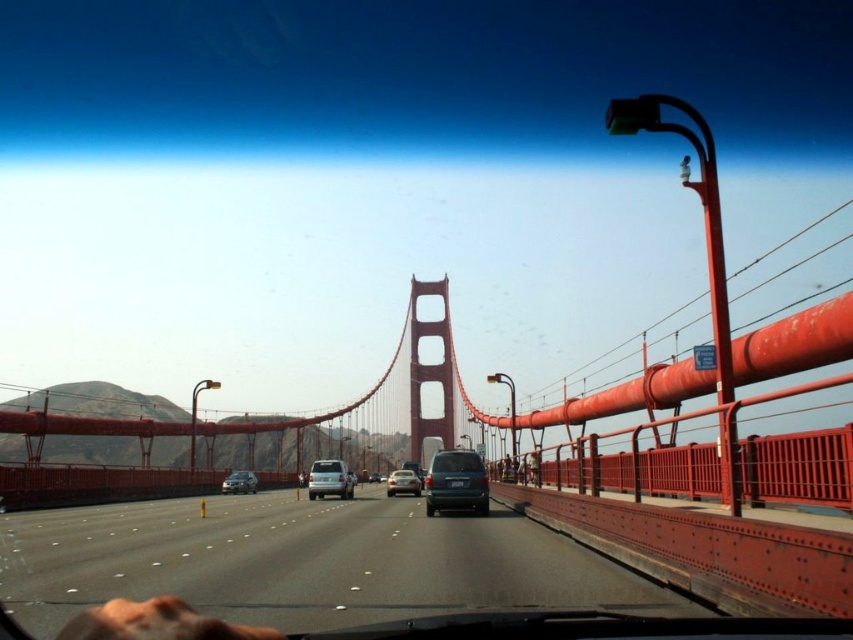
You are a passenger in a car and want to know which of the two sedans at the center of the Golden Gate Bridge view is closer to you. Both the satin silver sedan at center and the silver metallic sedan at center are visible. Which one is closer?

The satin silver sedan at center is larger in size than the silver metallic sedan at center, so the satin silver sedan at center is closer to you since objects closer appear larger.

You are driving a car and see a matte blue van at center and a satin silver sedan at center ahead on the road. Which vehicle is closer to the right side of the road?

The matte blue van at center is positioned on the right side of the satin silver sedan at center, so it is closer to the right side of the road.

You are a passenger in the vehicle and want to describe the object at point (329, 480). What is located there?

The point (329, 480) marks the satin silver van at center.